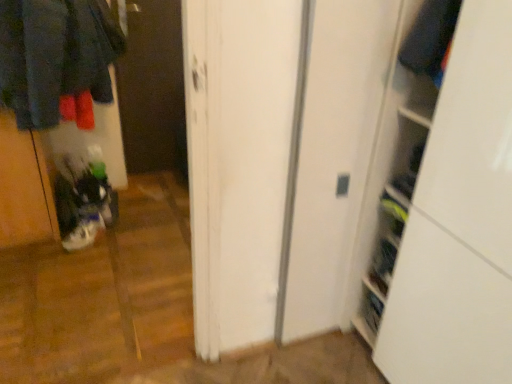
Question: Looking at the image, does velvet-like dark blue sweater at upper right seem bigger or smaller compared to white matte sneakers at lower left?

Choices:
 (A) small
 (B) big

Answer: (A)

Question: Does point (440, 31) appear closer or farther from the camera than point (69, 246)?

Choices:
 (A) closer
 (B) farther

Answer: (A)

Question: Estimate the real-world distances between objects in this image. Which object is closer to the velvet-like dark blue sweater at upper right?

Choices:
 (A) dark wood screen door at center
 (B) white matte sneakers at lower left

Answer: (B)

Question: Estimate the real-world distances between objects in this image. Which object is farther from the velvet-like dark blue sweater at upper right?

Choices:
 (A) white matte sneakers at lower left
 (B) dark wood screen door at center

Answer: (B)